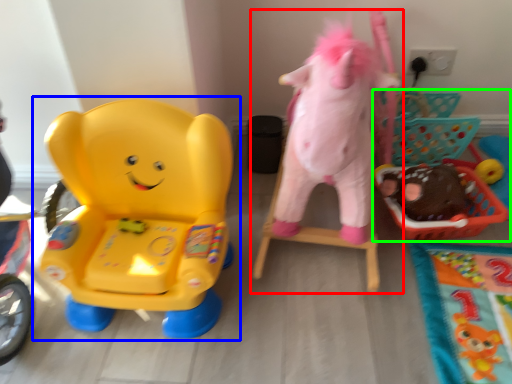
Question: Estimate the real-world distances between objects in this image. Which object is closer to toy (highlighted by a red box), toy (highlighted by a blue box) or toy (highlighted by a green box)?

Choices:
 (A) toy
 (B) toy

Answer: (B)